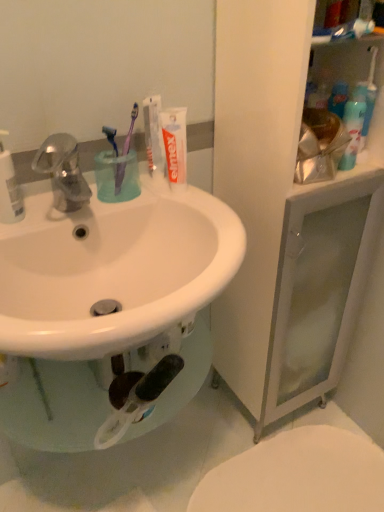
Find the location of `vacant space to the right of white plastic bottle at left, the 1th cleaning product in the front-to-back sequence`. vacant space to the right of white plastic bottle at left, the 1th cleaning product in the front-to-back sequence is located at coordinates (75, 207).